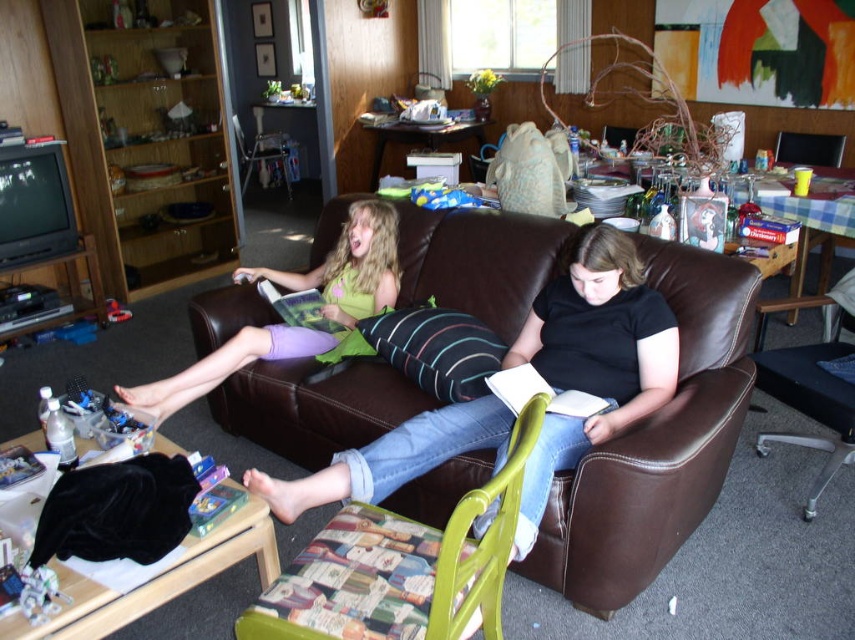
Which of these two, green fabric chair at lower center or brown leather armchair at right, stands shorter?

With less height is green fabric chair at lower center.

Does point (485, 493) come behind point (818, 440)?

That is False.

Locate an element on the screen. The width and height of the screenshot is (855, 640). green fabric chair at lower center is located at coordinates (433, 554).

Is point (687, 429) positioned behind point (783, 390)?

No, (687, 429) is closer to viewer.

Where is `brown leather couch at center`? The width and height of the screenshot is (855, 640). brown leather couch at center is located at coordinates (656, 444).

Which is in front, point (693, 312) or point (779, 435)?

Point (693, 312) is in front.

You are a GUI agent. You are given a task and a screenshot of the screen. Output one action in this format:
    pyautogui.click(x=<x>, y=<y>)
    Task: Click on the brown leather couch at center
    This screenshot has width=855, height=640.
    Given the screenshot: What is the action you would take?
    pyautogui.click(x=656, y=444)

Who is more distant from viewer, (526, 298) or (393, 564)?

Positioned behind is point (526, 298).

Is brown leather couch at center thinner than green fabric chair at lower center?

In fact, brown leather couch at center might be wider than green fabric chair at lower center.

Find the location of a particular element. Image resolution: width=855 pixels, height=640 pixels. brown leather couch at center is located at coordinates (656, 444).